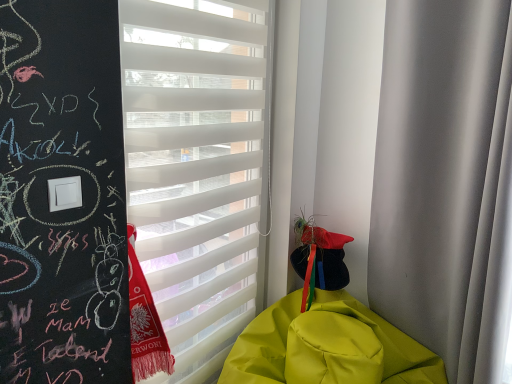
What is the approximate width of white matte window blind at center?

white matte window blind at center is 2.35 inches wide.

This screenshot has width=512, height=384. What do you see at coordinates (195, 167) in the screenshot?
I see `white matte window blind at center` at bounding box center [195, 167].

What do you see at coordinates (445, 182) in the screenshot? I see `white matte curtain at right` at bounding box center [445, 182].

Where is `white matte window blind at center`? white matte window blind at center is located at coordinates (195, 167).

What's the angular difference between white matte curtain at right and yellow matte blanket at lower right's facing directions?

0.0465 degrees separate the facing orientations of white matte curtain at right and yellow matte blanket at lower right.

Considering the positions of points (463, 55) and (281, 372), is point (463, 55) farther from camera compared to point (281, 372)?

No, it is not.

Does white matte curtain at right appear on the right side of yellow matte blanket at lower right?

Yes.

Consider the image. Between yellow matte blanket at lower right and white matte window blind at center, which one has smaller width?

With smaller width is white matte window blind at center.

From a real-world perspective, between yellow matte blanket at lower right and white matte window blind at center, who is vertically lower?

From a 3D spatial view, yellow matte blanket at lower right is below.

From a real-world perspective, is white matte window blind at center under yellow matte blanket at lower right?

Actually, white matte window blind at center is physically above yellow matte blanket at lower right in the real world.

Does white matte window blind at center have a greater height compared to yellow matte blanket at lower right?

Indeed, white matte window blind at center has a greater height compared to yellow matte blanket at lower right.

Is white matte window blind at center to the left of yellow matte blanket at lower right from the viewer's perspective?

Yes, white matte window blind at center is to the left of yellow matte blanket at lower right.

Which object is wider, white matte window blind at center or yellow matte blanket at lower right?

yellow matte blanket at lower right is wider.

Can you confirm if yellow matte blanket at lower right is smaller than white matte curtain at right?

Actually, yellow matte blanket at lower right might be larger than white matte curtain at right.

Is yellow matte blanket at lower right positioned with its back to white matte curtain at right?

Correct, yellow matte blanket at lower right is looking away from white matte curtain at right.

Is point (268, 341) positioned behind point (426, 315)?

That is True.

Image resolution: width=512 pixels, height=384 pixels. In order to click on curtain above the yellow matte blanket at lower right (from the image's perspective) in this screenshot , I will do coord(445,182).

Measure the distance from white matte window blind at center to white matte curtain at right.

white matte window blind at center is 28.77 inches from white matte curtain at right.

Considering the relative positions of white matte window blind at center and white matte curtain at right in the image provided, is white matte window blind at center to the left of white matte curtain at right from the viewer's perspective?

Indeed, white matte window blind at center is positioned on the left side of white matte curtain at right.

From a real-world perspective, is white matte window blind at center physically above white matte curtain at right?

Incorrect, from a real-world perspective, white matte window blind at center is lower than white matte curtain at right.

Is white matte window blind at center smaller than white matte curtain at right?

Yes, white matte window blind at center is smaller than white matte curtain at right.

From a real-world perspective, is white matte curtain at right over white matte window blind at center?

Yes.

Is white matte curtain at right turned away from white matte window blind at center?

No, white matte curtain at right is not facing the opposite direction of white matte window blind at center.

Who is shorter, white matte curtain at right or white matte window blind at center?

white matte curtain at right.

What's the angular difference between white matte curtain at right and white matte window blind at center's facing directions?

white matte curtain at right and white matte window blind at center are facing 90 degrees away from each other.

Locate an element on the screen. This screenshot has width=512, height=384. curtain located above the yellow matte blanket at lower right (from a real-world perspective) is located at coordinates (445, 182).

Where is `window blind located on the left of yellow matte blanket at lower right`? The height and width of the screenshot is (384, 512). window blind located on the left of yellow matte blanket at lower right is located at coordinates (195, 167).

Looking at the image, which one is located further to white matte curtain at right, white matte window blind at center or yellow matte blanket at lower right?

white matte window blind at center lies further to white matte curtain at right than the other object.

Based on their spatial positions, is yellow matte blanket at lower right or white matte window blind at center further from white matte curtain at right?

Based on the image, white matte window blind at center appears to be further to white matte curtain at right.

Looking at this image, which object lies further to the anchor point yellow matte blanket at lower right, white matte window blind at center or white matte curtain at right?

Based on the image, white matte window blind at center appears to be further to yellow matte blanket at lower right.

Looking at this image, which object lies further to the anchor point white matte window blind at center, white matte curtain at right or yellow matte blanket at lower right?

Among the two, white matte curtain at right is located further to white matte window blind at center.

Estimate the real-world distances between objects in this image. Which object is further from white matte window blind at center, yellow matte blanket at lower right or white matte curtain at right?

white matte curtain at right is positioned further to the anchor white matte window blind at center.

Based on their spatial positions, is white matte curtain at right or white matte window blind at center further from yellow matte blanket at lower right?

Among the two, white matte window blind at center is located further to yellow matte blanket at lower right.

Where is `curtain between white matte window blind at center and yellow matte blanket at lower right in the up-down direction`? The image size is (512, 384). curtain between white matte window blind at center and yellow matte blanket at lower right in the up-down direction is located at coordinates (445, 182).